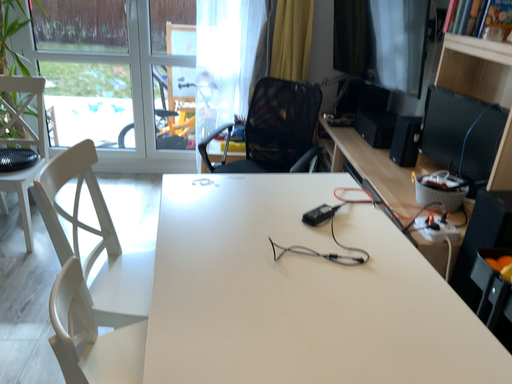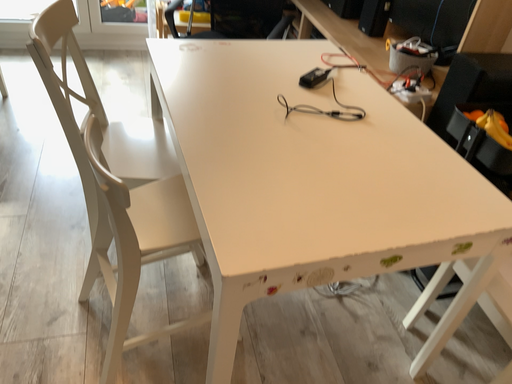
Question: How did the camera likely rotate when shooting the video?

Choices:
 (A) rotated right
 (B) rotated left

Answer: (A)